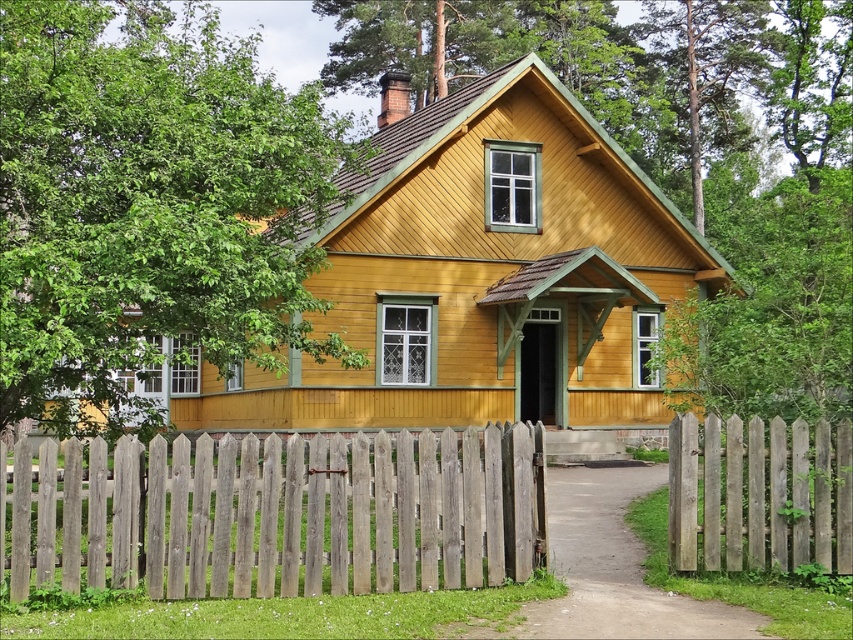
Question: Which point is farther to the camera?

Choices:
 (A) weathered wood fence at lower right
 (B) weathered wood fence at center

Answer: (A)

Question: Which of the following is the closest to the observer?

Choices:
 (A) (299, 332)
 (B) (343, 426)
 (C) (688, 483)
 (D) (515, 490)

Answer: (D)

Question: Estimate the real-world distances between objects in this image. Which object is farther from the weathered wood fence at center?

Choices:
 (A) weathered wood fence at lower right
 (B) green leafy tree at upper left

Answer: (B)

Question: Is weathered wood fence at center in front of weathered wood fence at lower right?

Choices:
 (A) yes
 (B) no

Answer: (A)

Question: Is green leafy tree at upper left above weathered wood fence at lower right?

Choices:
 (A) no
 (B) yes

Answer: (B)

Question: Is green leafy tree at upper left positioned behind weathered wood fence at center?

Choices:
 (A) no
 (B) yes

Answer: (B)